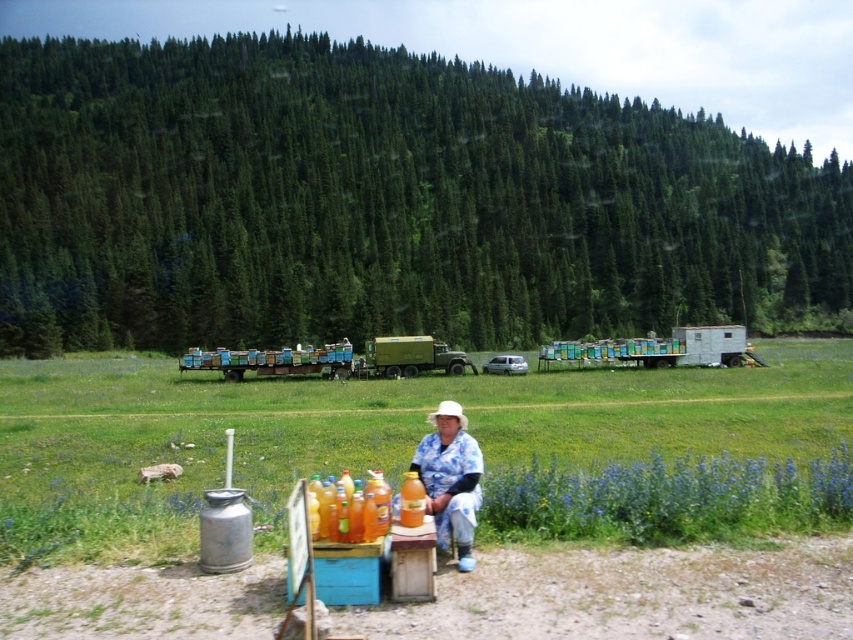
Question: Which point is farther to the camera?

Choices:
 (A) (207, 362)
 (B) (589, 454)
 (C) (448, 358)
 (D) (456, 422)

Answer: (C)

Question: Is the position of wooden beehives at center less distant than that of green matte truck at center?

Choices:
 (A) yes
 (B) no

Answer: (A)

Question: Is metallic canister at lower left wider than wooden beehives at center?

Choices:
 (A) no
 (B) yes

Answer: (B)

Question: Which point is farther from the camera taking this photo?

Choices:
 (A) (397, 355)
 (B) (27, 492)

Answer: (A)

Question: Is wooden beehives at center above green matte truck at center?

Choices:
 (A) no
 (B) yes

Answer: (A)

Question: Estimate the real-world distances between objects in this image. Which object is closer to the metallic canister at lower left?

Choices:
 (A) green matte truck at center
 (B) blue floral shirt at center
 (C) wooden beehives at center

Answer: (A)